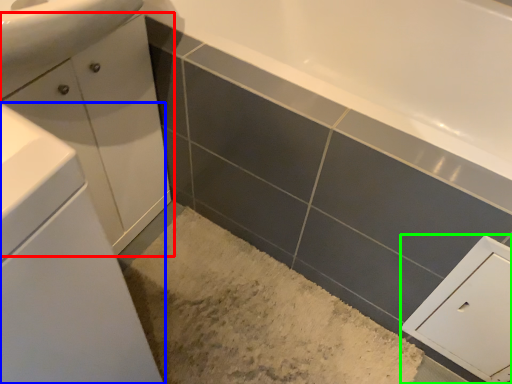
Question: Which is farther away from bathroom cabinet (highlighted by a red box)? bathroom cabinet (highlighted by a blue box) or cabinetry (highlighted by a green box)?

Choices:
 (A) bathroom cabinet
 (B) cabinetry

Answer: (B)